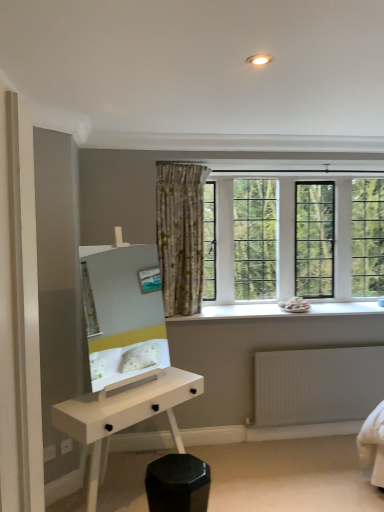
Where is `vacant area in front of white ribbed radiator at lower right`? The height and width of the screenshot is (512, 384). vacant area in front of white ribbed radiator at lower right is located at coordinates pos(322,468).